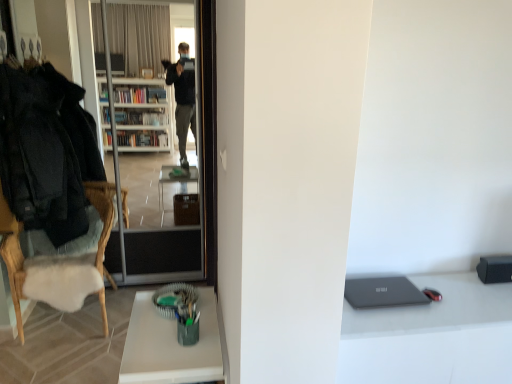
Question: From the image's perspective, is matte gray laptop at lower right above white sheepskin cushion at left?

Choices:
 (A) no
 (B) yes

Answer: (A)

Question: Is matte gray laptop at lower right aimed at white sheepskin cushion at left?

Choices:
 (A) yes
 (B) no

Answer: (B)

Question: From a real-world perspective, is matte gray laptop at lower right positioned over white sheepskin cushion at left based on gravity?

Choices:
 (A) no
 (B) yes

Answer: (B)

Question: Considering the relative sizes of matte gray laptop at lower right and white sheepskin cushion at left in the image provided, is matte gray laptop at lower right taller than white sheepskin cushion at left?

Choices:
 (A) yes
 (B) no

Answer: (B)

Question: From the image's perspective, does matte gray laptop at lower right appear lower than white sheepskin cushion at left?

Choices:
 (A) yes
 (B) no

Answer: (A)

Question: Could white sheepskin cushion at left be considered to be inside matte gray laptop at lower right?

Choices:
 (A) yes
 (B) no

Answer: (B)

Question: Is transparent glass screen door at left bigger than matte gray laptop at lower right?

Choices:
 (A) no
 (B) yes

Answer: (B)

Question: Does transparent glass screen door at left turn towards matte gray laptop at lower right?

Choices:
 (A) no
 (B) yes

Answer: (A)

Question: From the image's perspective, is transparent glass screen door at left over matte gray laptop at lower right?

Choices:
 (A) yes
 (B) no

Answer: (A)

Question: Is transparent glass screen door at left far away from matte gray laptop at lower right?

Choices:
 (A) no
 (B) yes

Answer: (B)

Question: From a real-world perspective, is transparent glass screen door at left positioned under matte gray laptop at lower right based on gravity?

Choices:
 (A) no
 (B) yes

Answer: (A)

Question: From a real-world perspective, is transparent glass screen door at left over matte gray laptop at lower right?

Choices:
 (A) yes
 (B) no

Answer: (A)

Question: Can you confirm if green matte cup at lower center is wider than black woolen jacket at left?

Choices:
 (A) no
 (B) yes

Answer: (B)